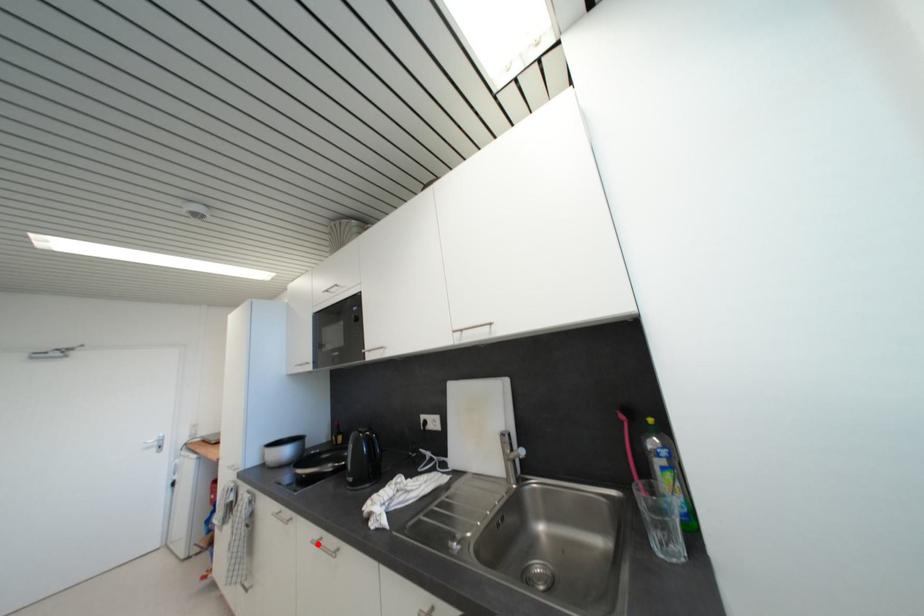
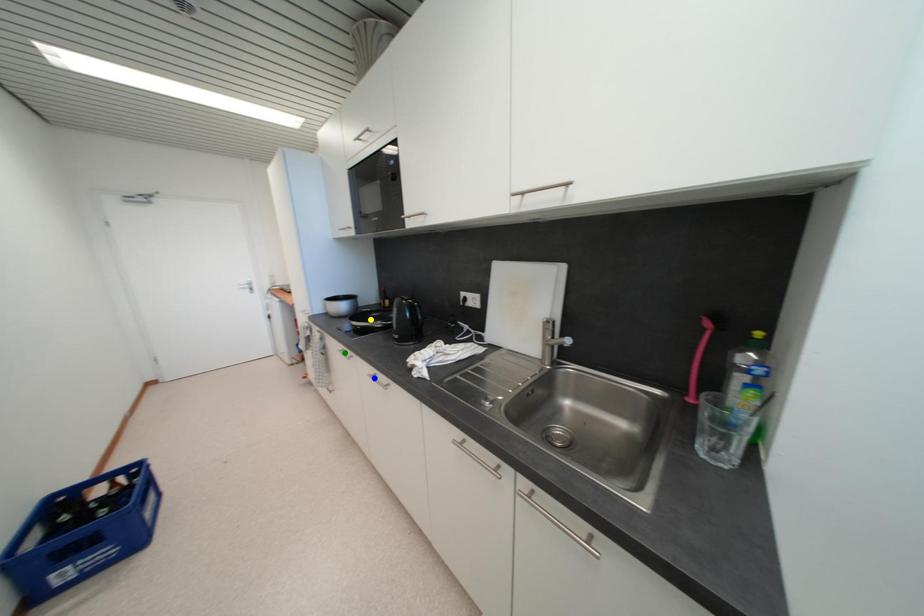
Question: I am providing you with two images of the same scene from different viewpoints. A red point is marked on the first image. You are given multiple points on the second image. Which mark in image 2 goes with the point in image 1?

Choices:
 (A) yellow point
 (B) blue point
 (C) green point

Answer: (B)